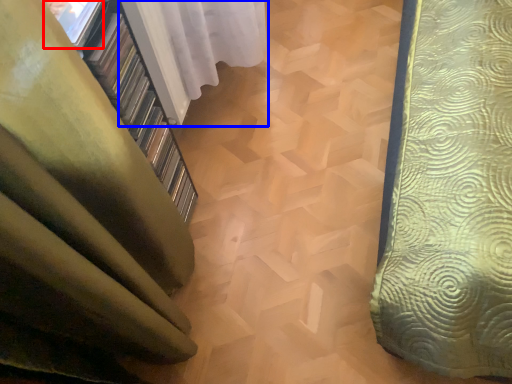
Question: Among these objects, which one is nearest to the camera, window (highlighted by a red box) or curtain (highlighted by a blue box)?

Choices:
 (A) window
 (B) curtain

Answer: (A)